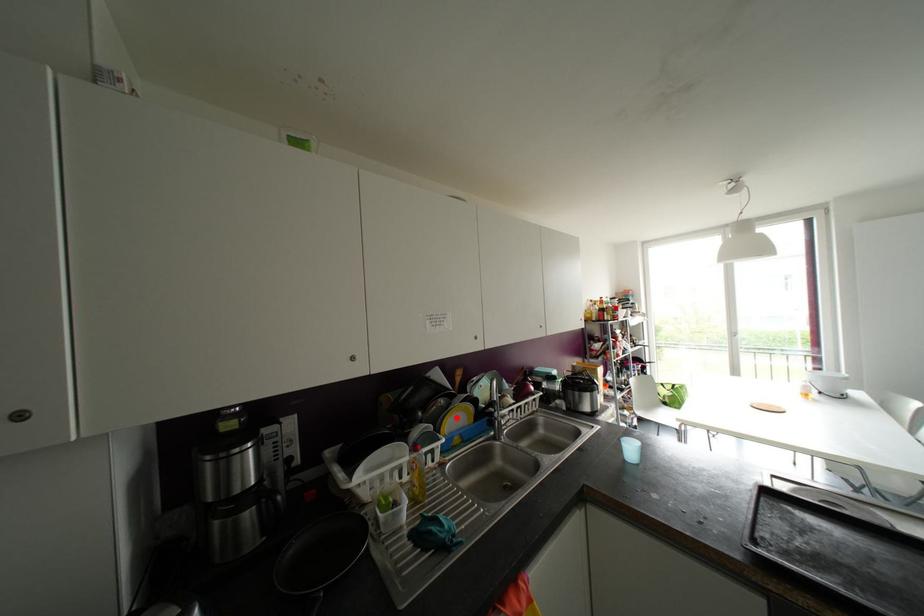
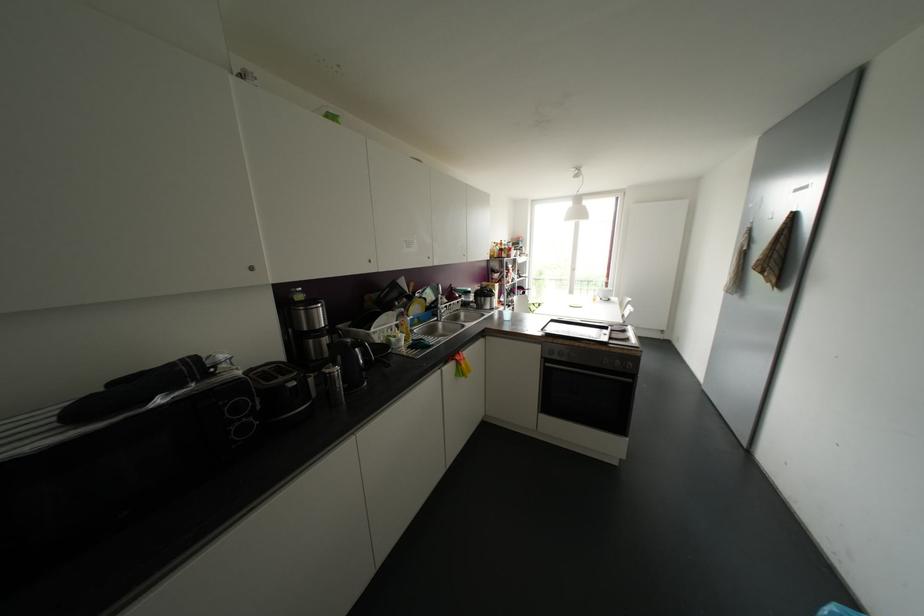
Question: I am providing you with two images of the same scene from different viewpoints. In image1, a red point is highlighted. Considering the same 3D point in image2, which of the following is correct?

Choices:
 (A) It is closer
 (B) It is farther

Answer: (A)